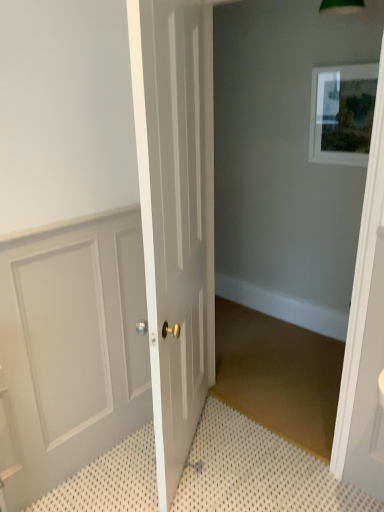
I want to click on vacant region above white panelled door at left, marked as the second door in a right-to-left arrangement (from a real-world perspective), so click(61, 218).